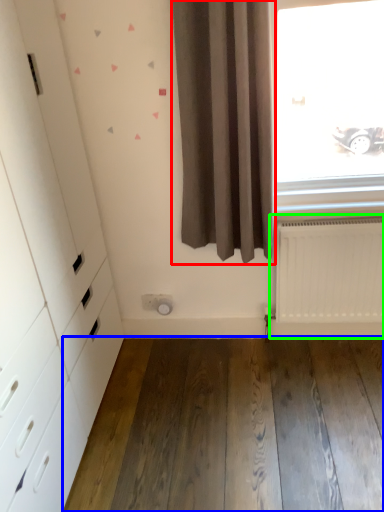
Question: Which is farther away from curtain (highlighted by a red box)? hardwood (highlighted by a blue box) or radiator (highlighted by a green box)?

Choices:
 (A) hardwood
 (B) radiator

Answer: (A)